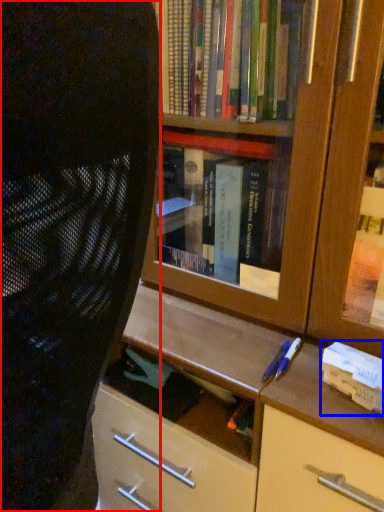
Question: Which of the following is the closest to the observer, person (highlighted by a red box) or paperback book (highlighted by a blue box)?

Choices:
 (A) person
 (B) paperback book

Answer: (A)